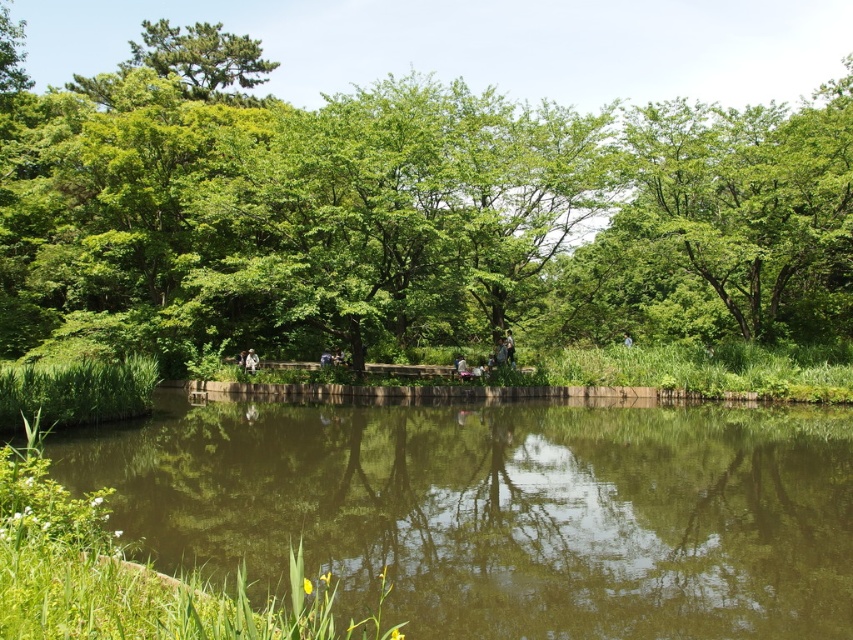
You are a photographer planning to capture the entire scene in one shot. Given that the green reflective water at center and the green leafy tree at upper left are both important elements, which one should you focus on to ensure both are visible without cropping?

Since the green reflective water at center occupies less space than the green leafy tree at upper left, you should focus on the green reflective water at center to ensure both elements are visible without cropping, as it requires less space to frame properly.

You are standing at the point labeled point [390,160] and want to walk to the point labeled point [201,36]. Which direction should you face to move towards your destination?

You should face towards the upper left direction to move from point [390,160] to point [201,36] because point [201,36] is located in that direction relative to point [390,160].

You are standing at the point with coordinates (x=408, y=218) in the image. What object are you directly facing?

You are directly facing the green leafy tree at center as the point corresponds to its location.